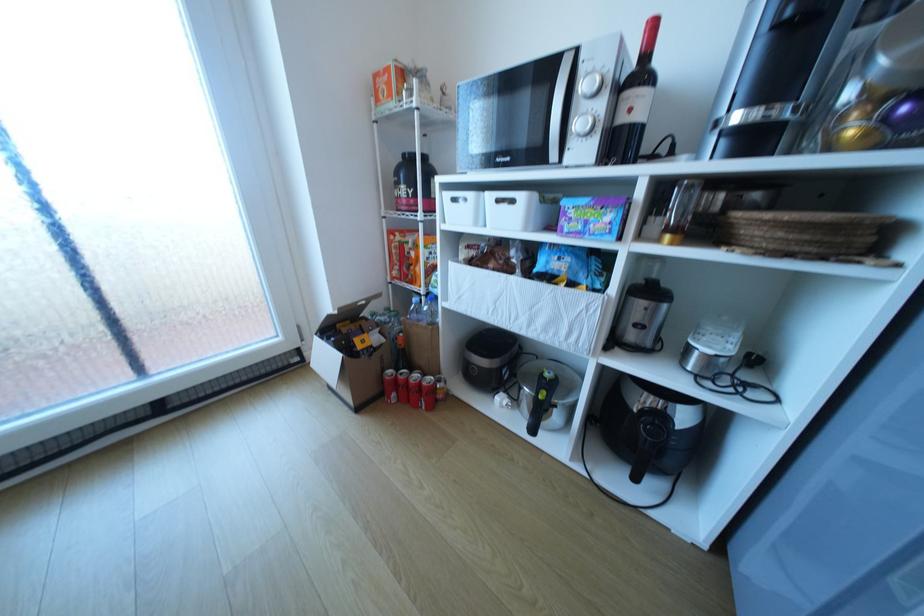
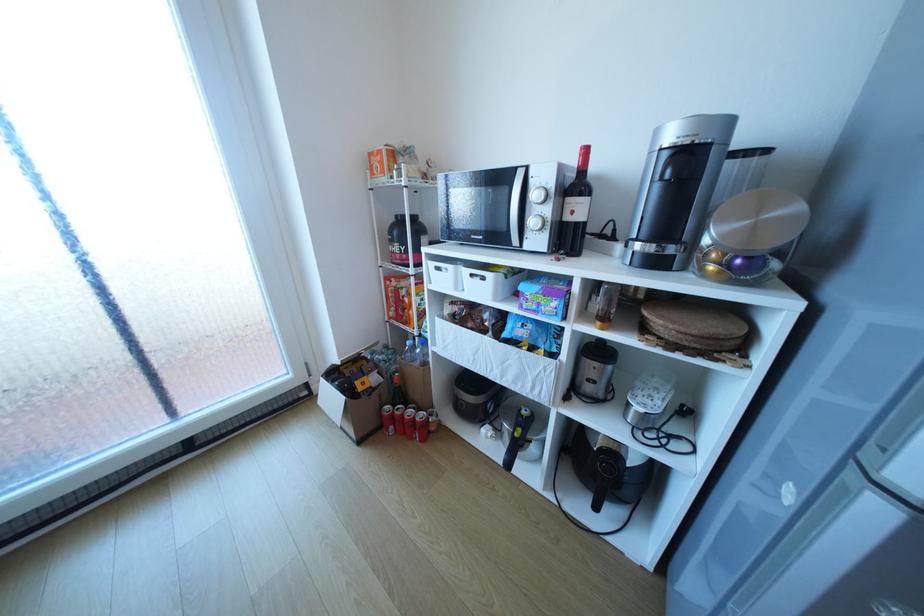
Where in the second image is the point corresponding to point 393,371 from the first image?

(391, 407)